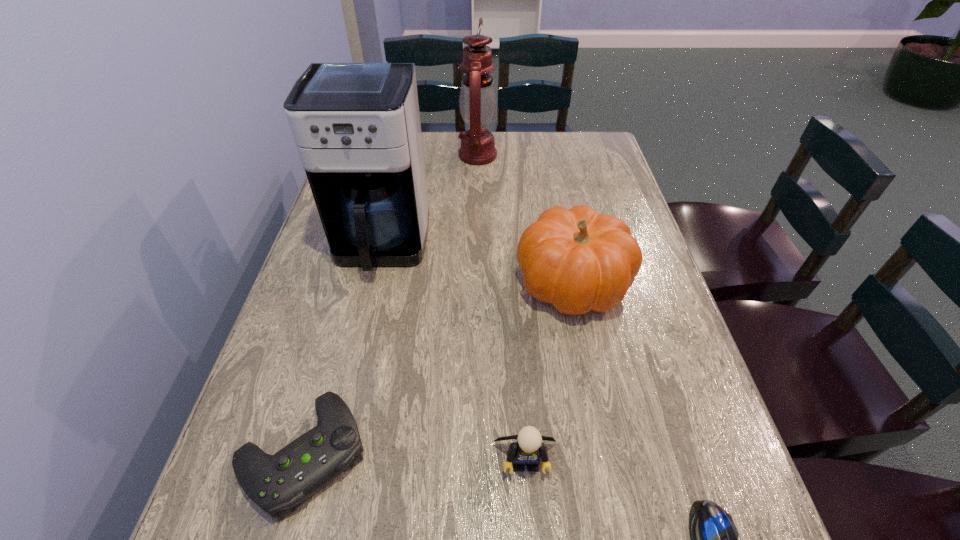
Identify the location of coffee maker. (356, 125).

Locate an element on the screen. the farthest object is located at coordinates (477, 101).

Locate an element on the screen. This screenshot has width=960, height=540. pumpkin is located at coordinates (577, 260).

The height and width of the screenshot is (540, 960). I want to click on the fourth tallest object, so click(529, 448).

Where is `the second shortest object`? The image size is (960, 540). the second shortest object is located at coordinates (x=276, y=483).

Where is `blank space located on the front panel of the coffee maker`? The width and height of the screenshot is (960, 540). blank space located on the front panel of the coffee maker is located at coordinates (360, 338).

I want to click on vacant space located on the front of the farthest object, so click(478, 180).

Locate an element on the screen. vacant space located on the front of the fourth shortest object is located at coordinates (623, 537).

Where is `blank area located 0.070m on the back of the fifth tallest object`? The height and width of the screenshot is (540, 960). blank area located 0.070m on the back of the fifth tallest object is located at coordinates (328, 364).

Identify the location of object at the far edge. (477, 101).